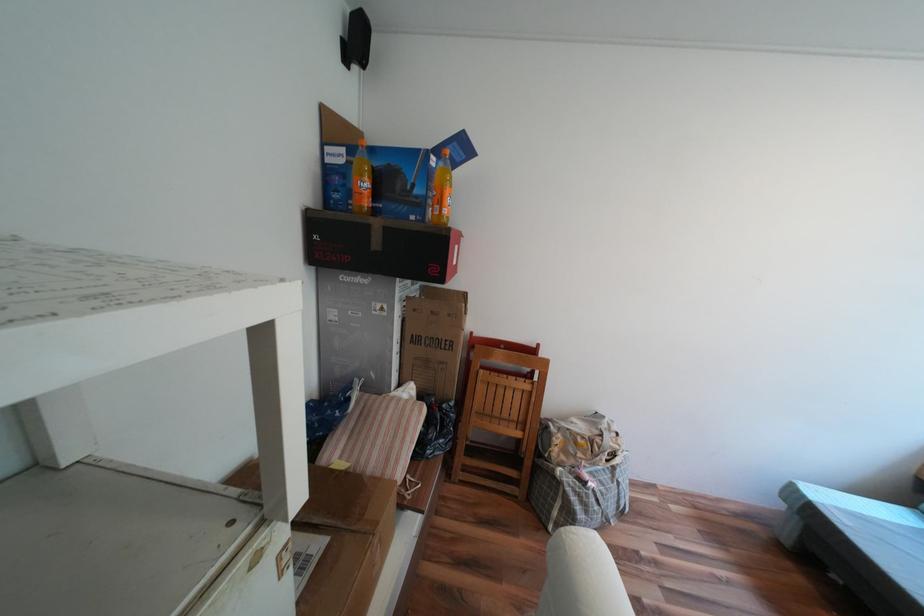
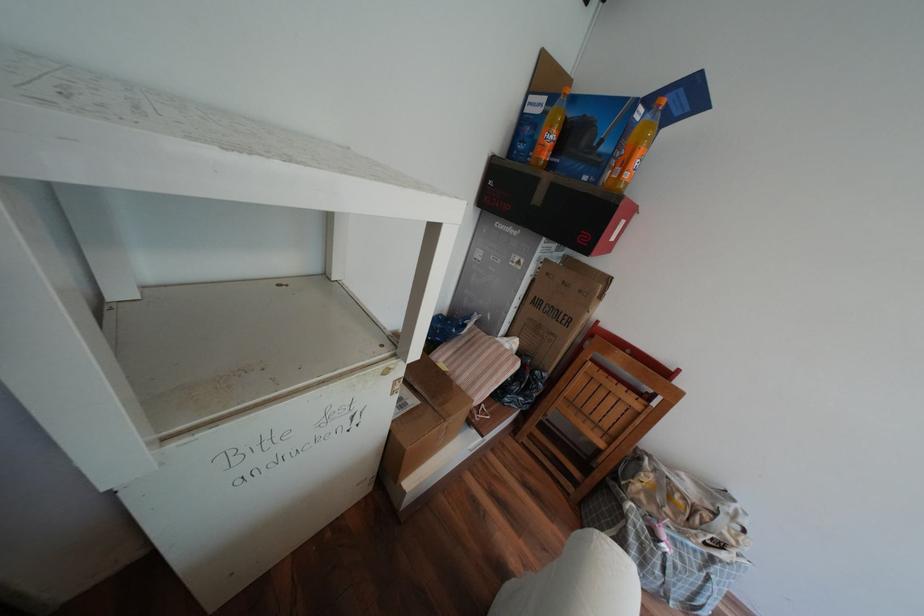
The point at (435, 197) is marked in the first image. Where is the corresponding point in the second image?

(621, 156)